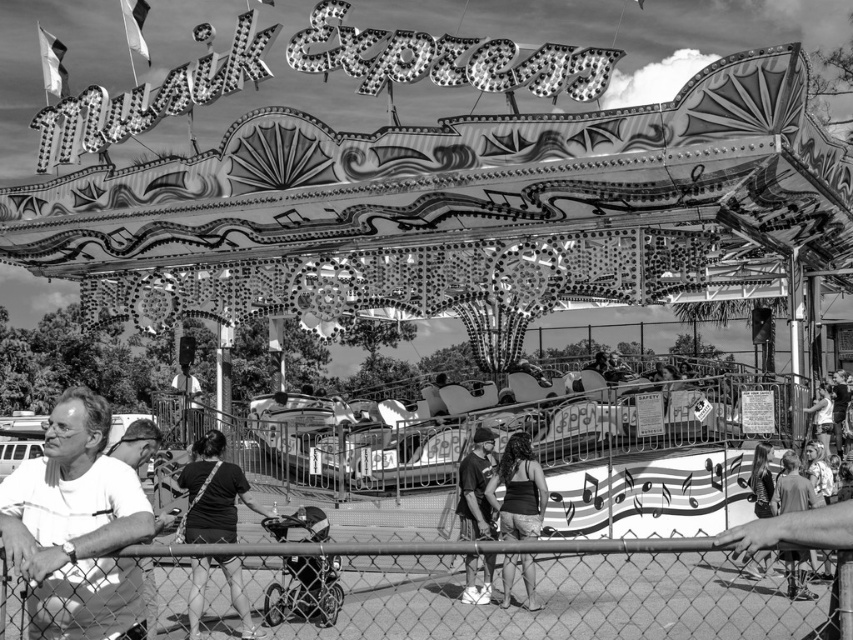
Question: Can you confirm if white matte shirt at lower left is positioned above dark blue jeans at center?

Choices:
 (A) yes
 (B) no

Answer: (A)

Question: Estimate the real-world distances between objects in this image. Which object is farther from the dark hair at center?

Choices:
 (A) chain link fence at lower center
 (B) dark blue jeans at center
 (C) white matte shirt at lower left
 (D) dark gray fabric purse at lower center

Answer: (C)

Question: Which point is farther from the camera taking this photo?

Choices:
 (A) (473, 472)
 (B) (231, 486)
 (C) (96, 516)

Answer: (A)

Question: Can you confirm if chain link fence at lower center is thinner than dark gray fabric purse at lower center?

Choices:
 (A) no
 (B) yes

Answer: (A)

Question: Which point appears farthest from the camera in this image?

Choices:
 (A) (146, 572)
 (B) (38, 570)
 (C) (469, 472)

Answer: (C)

Question: Can you confirm if dark gray fabric purse at lower center is wider than dark blue jeans at center?

Choices:
 (A) yes
 (B) no

Answer: (A)